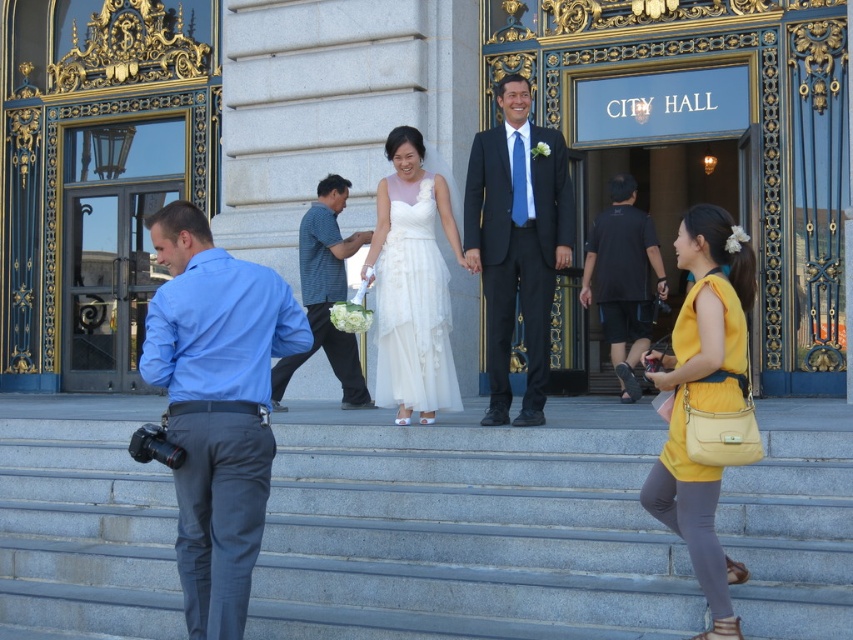
Question: Which point is closer to the camera taking this photo?

Choices:
 (A) (500, 580)
 (B) (521, 304)

Answer: (A)

Question: Which is nearer to the shiny black suit at center?

Choices:
 (A) striped cotton shirt at center
 (B) black cotton t-shirt at center

Answer: (A)

Question: Is white satin dress at center above black cotton t-shirt at center?

Choices:
 (A) no
 (B) yes

Answer: (A)

Question: From the image, what is the correct spatial relationship of shiny black suit at center in relation to striped cotton shirt at center?

Choices:
 (A) left
 (B) right

Answer: (B)

Question: Which point is closer to the camera?

Choices:
 (A) white lace dress at center
 (B) shiny black suit at center
 (C) white satin dress at center
 (D) black cotton t-shirt at center

Answer: (C)

Question: Can you confirm if blue cotton shirt at left is smaller than white lace dress at center?

Choices:
 (A) yes
 (B) no

Answer: (B)